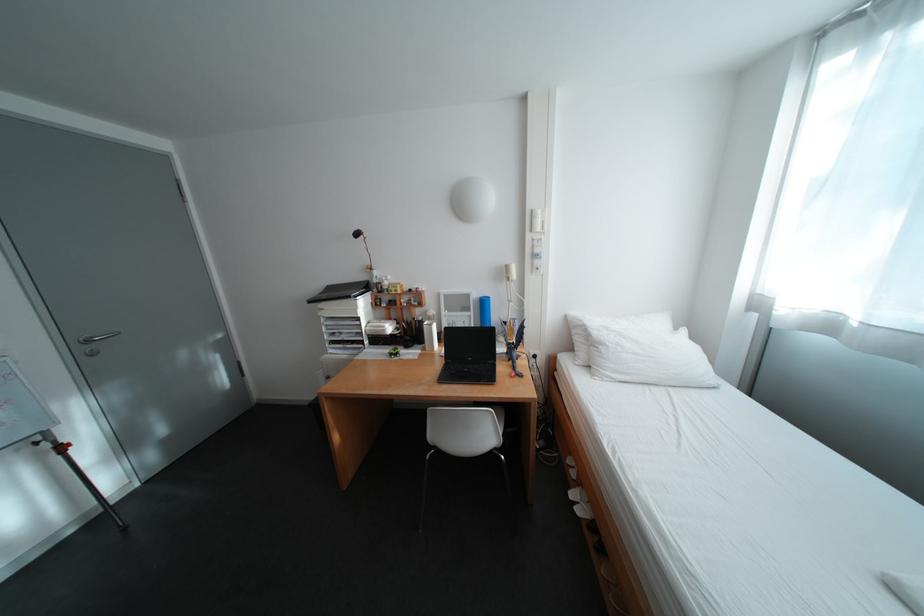
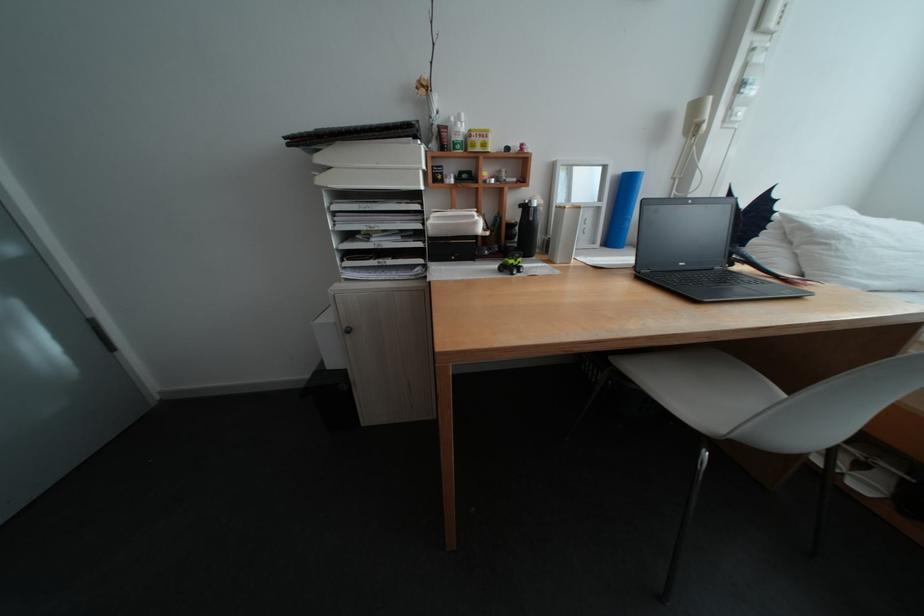
Locate, in the second image, the point that corresponds to point (388, 285) in the first image.

(453, 128)